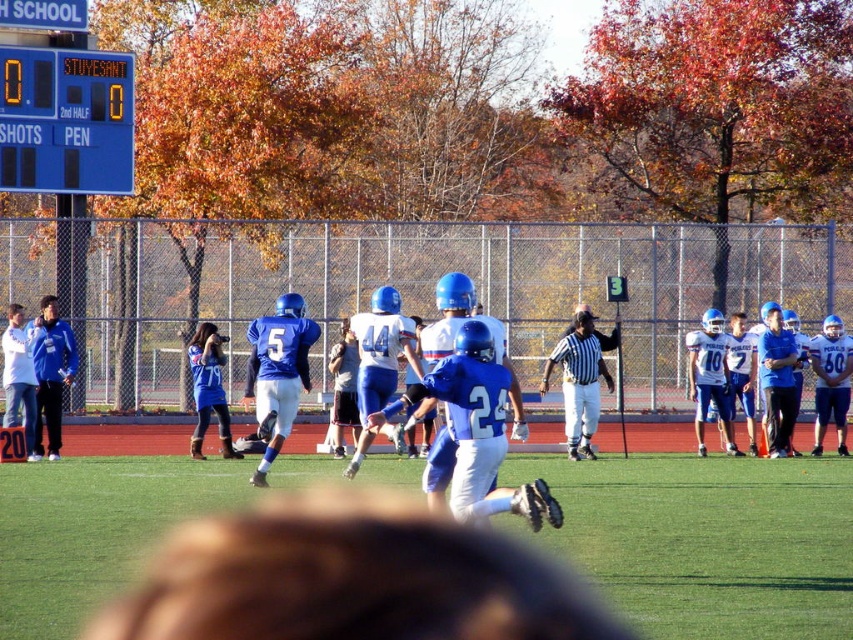
Question: Is blue plastic scoreboard at upper left closer to the viewer compared to blue matte uniform at right?

Choices:
 (A) yes
 (B) no

Answer: (B)

Question: Is green grass football field at center below blue plastic scoreboard at upper left?

Choices:
 (A) yes
 (B) no

Answer: (A)

Question: Which object appears closest to the camera in this image?

Choices:
 (A) blue plastic scoreboard at upper left
 (B) green grass football field at center

Answer: (B)

Question: Which of the following is the farthest from the observer?

Choices:
 (A) (30, 177)
 (B) (32, 611)
 (C) (775, 387)

Answer: (A)

Question: Among these points, which one is farthest from the camera?

Choices:
 (A) (764, 408)
 (B) (36, 100)

Answer: (B)

Question: Is blue plastic scoreboard at upper left wider than blue matte uniform at right?

Choices:
 (A) no
 (B) yes

Answer: (B)